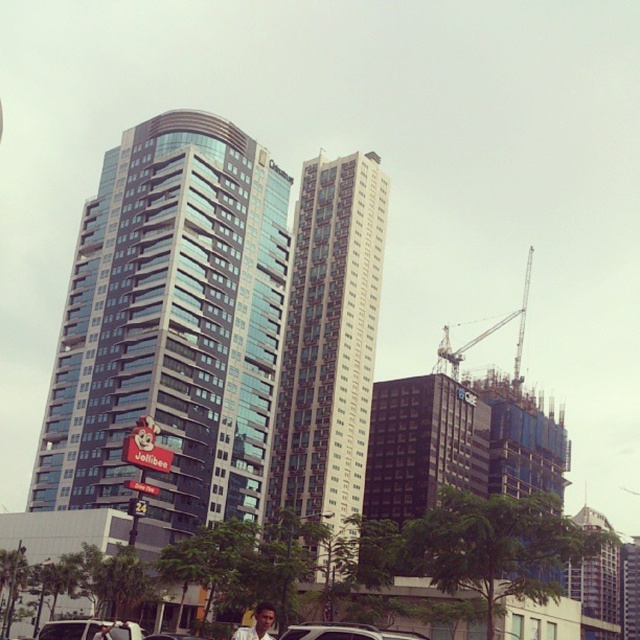
Question: Among these points, which one is farthest from the camera?

Choices:
 (A) (152, 320)
 (B) (96, 634)

Answer: (A)

Question: Which point is closer to the camera taking this photo?

Choices:
 (A) (440, 344)
 (B) (611, 570)
 (C) (344, 484)

Answer: (C)

Question: Is glassy steel building at left smaller than metallic gray crane at right?

Choices:
 (A) yes
 (B) no

Answer: (A)

Question: Among these objects, which one is farthest from the camera?

Choices:
 (A) metallic gray crane at right
 (B) light brown hair at lower center
 (C) metallic silver car at center
 (D) metallic silver car at lower left

Answer: (A)

Question: Where is silver metallic suv at center located in relation to metallic silver car at lower left in the image?

Choices:
 (A) right
 (B) left

Answer: (A)

Question: Is silver metallic suv at center in front of metallic silver car at center?

Choices:
 (A) yes
 (B) no

Answer: (A)